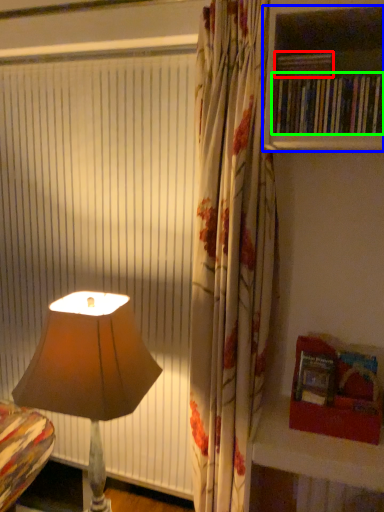
Question: Considering the real-world distances, which object is closest to book (highlighted by a red box)? shelf (highlighted by a blue box) or book (highlighted by a green box).

Choices:
 (A) shelf
 (B) book

Answer: (B)